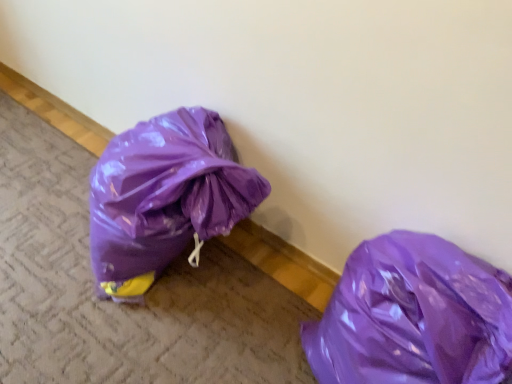
You are a GUI agent. You are given a task and a screenshot of the screen. Output one action in this format:
    pyautogui.click(x=<x>, y=<y>)
    Task: Click on the glossy plastic bag at lower left
    
    Given the screenshot: What is the action you would take?
    pyautogui.click(x=122, y=304)

What do you see at coordinates (122, 304) in the screenshot?
I see `glossy plastic bag at lower left` at bounding box center [122, 304].

What do you see at coordinates (413, 316) in the screenshot?
I see `glossy plastic bag at lower right` at bounding box center [413, 316].

Find the location of `glossy plastic bag at lower right`. glossy plastic bag at lower right is located at coordinates (413, 316).

What is the approximate width of glossy plastic bag at lower right?

15.29 inches.

Image resolution: width=512 pixels, height=384 pixels. I want to click on glossy plastic bag at lower left, so click(122, 304).

Which object is positioned more to the left, glossy plastic bag at lower left or glossy plastic bag at lower right?

glossy plastic bag at lower left is more to the left.

In the image, is glossy plastic bag at lower left positioned in front of or behind glossy plastic bag at lower right?

Visually, glossy plastic bag at lower left is located behind glossy plastic bag at lower right.

Is point (71, 289) closer or farther from the camera than point (351, 336)?

Clearly, point (71, 289) is more distant from the camera than point (351, 336).

From the image's perspective, which object appears higher, glossy plastic bag at lower left or glossy plastic bag at lower right?

glossy plastic bag at lower left is shown above in the image.

From a real-world perspective, which object rests below the other?

glossy plastic bag at lower left.

Between glossy plastic bag at lower left and glossy plastic bag at lower right, which one has larger width?

With larger width is glossy plastic bag at lower left.

Does glossy plastic bag at lower left have a lesser height compared to glossy plastic bag at lower right?

Yes, glossy plastic bag at lower left is shorter than glossy plastic bag at lower right.

Is glossy plastic bag at lower left bigger than glossy plastic bag at lower right?

Incorrect, glossy plastic bag at lower left is not larger than glossy plastic bag at lower right.

Is glossy plastic bag at lower right completely or partially inside glossy plastic bag at lower left?

No.

Are glossy plastic bag at lower left and glossy plastic bag at lower right located far from each other?

Actually, glossy plastic bag at lower left and glossy plastic bag at lower right are a little close together.

Is glossy plastic bag at lower left facing towards glossy plastic bag at lower right?

No, glossy plastic bag at lower left is not turned towards glossy plastic bag at lower right.

How many degrees apart are the facing directions of glossy plastic bag at lower left and glossy plastic bag at lower right?

90.1 degrees separate the facing orientations of glossy plastic bag at lower left and glossy plastic bag at lower right.

Image resolution: width=512 pixels, height=384 pixels. What are the coordinates of `pavement behind the glossy plastic bag at lower right` in the screenshot? It's located at (122, 304).

Which object is positioned more to the right, glossy plastic bag at lower right or glossy plastic bag at lower left?

glossy plastic bag at lower right.

Which object is closer to the camera, glossy plastic bag at lower right or glossy plastic bag at lower left?

glossy plastic bag at lower right is in front.

Between point (354, 320) and point (224, 256), which one is positioned behind?

The point (224, 256) is farther from the camera.

From the image's perspective, does glossy plastic bag at lower right appear lower than glossy plastic bag at lower left?

Yes, from the image's perspective, glossy plastic bag at lower right is beneath glossy plastic bag at lower left.

From a real-world perspective, who is located lower, glossy plastic bag at lower right or glossy plastic bag at lower left?

glossy plastic bag at lower left is physically lower.

Does glossy plastic bag at lower right have a lesser width compared to glossy plastic bag at lower left?

Indeed, glossy plastic bag at lower right has a lesser width compared to glossy plastic bag at lower left.

Between glossy plastic bag at lower right and glossy plastic bag at lower left, which one has more height?

glossy plastic bag at lower right.

Can you confirm if glossy plastic bag at lower right is smaller than glossy plastic bag at lower left?

Incorrect, glossy plastic bag at lower right is not smaller in size than glossy plastic bag at lower left.

Can we say glossy plastic bag at lower right lies outside glossy plastic bag at lower left?

Yes.

Looking at this image, are glossy plastic bag at lower right and glossy plastic bag at lower left making contact?

They are not placed beside each other.

Is glossy plastic bag at lower right facing away from glossy plastic bag at lower left?

No, glossy plastic bag at lower right is not facing away from glossy plastic bag at lower left.

Can you tell me how much glossy plastic bag at lower right and glossy plastic bag at lower left differ in facing direction?

90.1 degrees.

The image size is (512, 384). What are the coordinates of `pavement below the glossy plastic bag at lower right (from a real-world perspective)` in the screenshot? It's located at (122, 304).

Identify the location of pavement located behind the glossy plastic bag at lower right. The width and height of the screenshot is (512, 384). (122, 304).

Identify the location of pavement beneath the glossy plastic bag at lower right (from a real-world perspective). (122, 304).